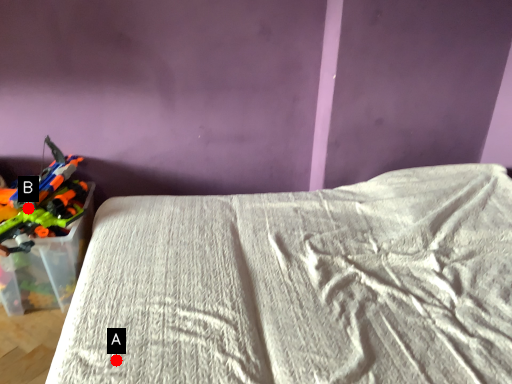
Question: Two points are circled on the image, labeled by A and B beside each circle. Among these points, which one is nearest to the camera?

Choices:
 (A) A is closer
 (B) B is closer

Answer: (A)